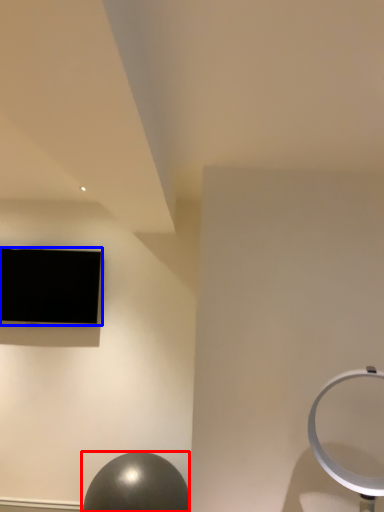
Question: Which point is further to the camera, ball (highlighted by a red box) or television (highlighted by a blue box)?

Choices:
 (A) ball
 (B) television

Answer: (B)